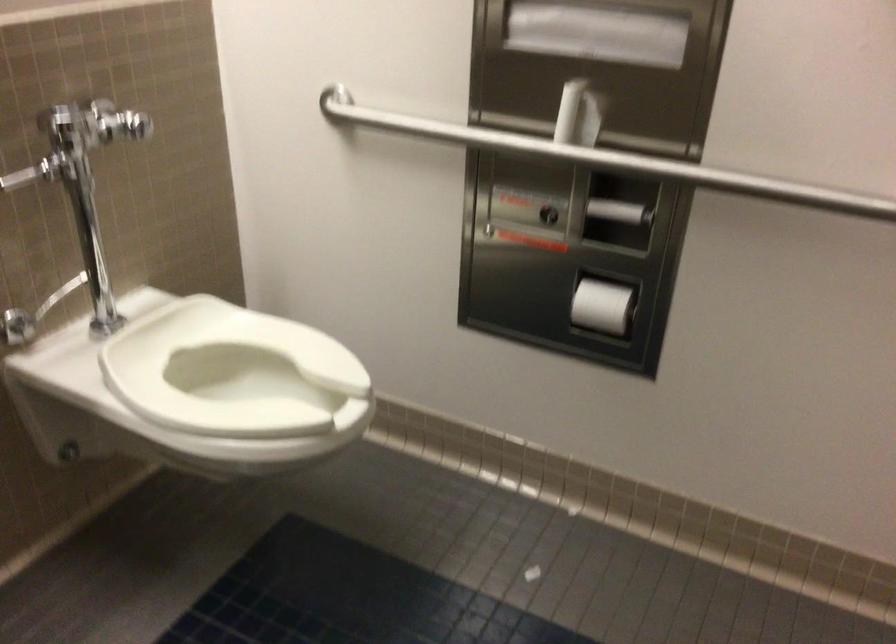
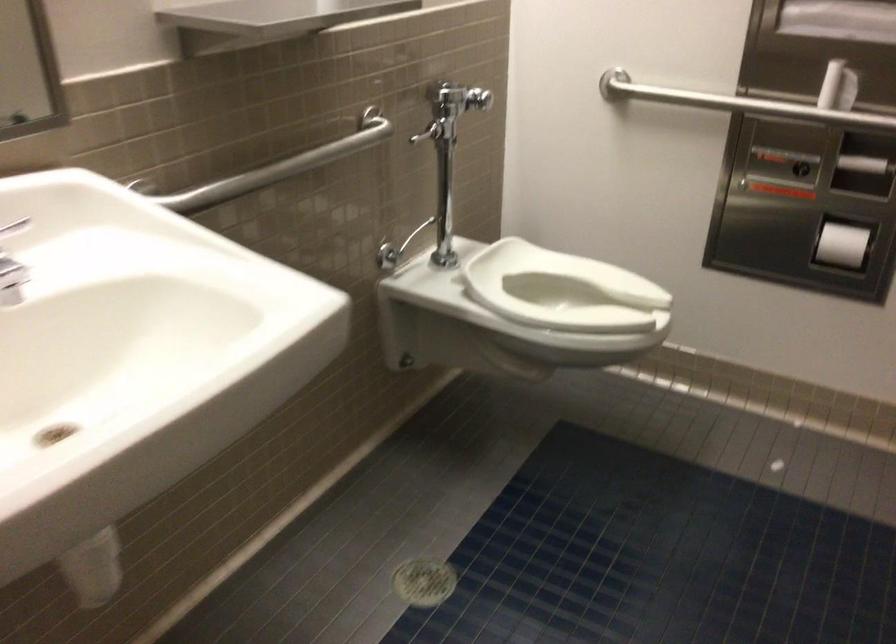
Find the pixel in the second image that matches [595,313] in the first image.

(841, 245)